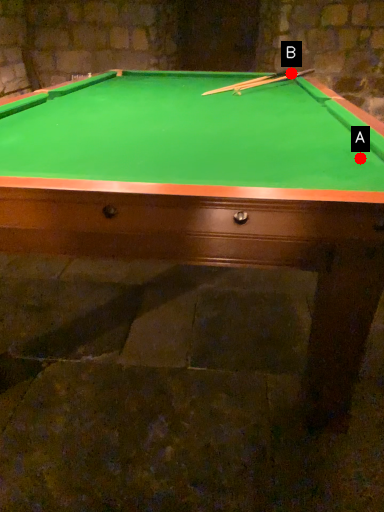
Question: Two points are circled on the image, labeled by A and B beside each circle. Which of the following is the closest to the observer?

Choices:
 (A) A is closer
 (B) B is closer

Answer: (A)